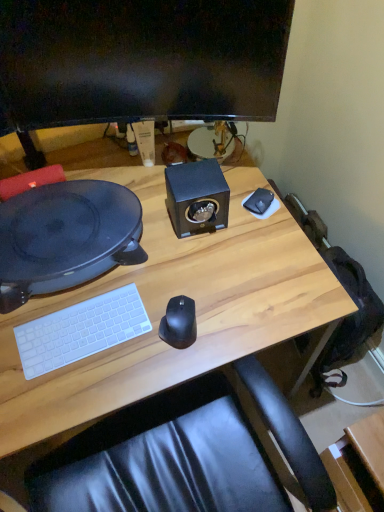
Question: Considering the relative positions of black plastic record player at left and white matte mousepad at upper right in the image provided, is black plastic record player at left to the left of white matte mousepad at upper right from the viewer's perspective?

Choices:
 (A) no
 (B) yes

Answer: (B)

Question: Would you say white matte mousepad at upper right is part of black plastic record player at left's contents?

Choices:
 (A) no
 (B) yes

Answer: (A)

Question: Is black plastic record player at left thinner than white matte mousepad at upper right?

Choices:
 (A) yes
 (B) no

Answer: (B)

Question: Does black plastic record player at left turn towards white matte mousepad at upper right?

Choices:
 (A) no
 (B) yes

Answer: (A)

Question: From a real-world perspective, is black plastic record player at left physically below white matte mousepad at upper right?

Choices:
 (A) no
 (B) yes

Answer: (A)

Question: Is black matte mouse at center wider or thinner than black matte speaker at center?

Choices:
 (A) wide
 (B) thin

Answer: (B)

Question: From a real-world perspective, relative to black matte speaker at center, is black matte mouse at center vertically above or below?

Choices:
 (A) above
 (B) below

Answer: (B)

Question: Visually, is black matte mouse at center positioned to the left or to the right of black matte speaker at center?

Choices:
 (A) right
 (B) left

Answer: (B)

Question: Is black matte mouse at center inside or outside of black matte speaker at center?

Choices:
 (A) outside
 (B) inside

Answer: (A)

Question: From a real-world perspective, is black plastic record player at left positioned above or below black matte speaker at center?

Choices:
 (A) above
 (B) below

Answer: (B)

Question: Is point (26, 248) positioned closer to the camera than point (221, 203)?

Choices:
 (A) closer
 (B) farther

Answer: (A)

Question: In terms of size, does black plastic record player at left appear bigger or smaller than black matte speaker at center?

Choices:
 (A) big
 (B) small

Answer: (A)

Question: In terms of width, does black plastic record player at left look wider or thinner when compared to black matte speaker at center?

Choices:
 (A) wide
 (B) thin

Answer: (A)

Question: From the image's perspective, is black matte mouse at center located above or below white matte mousepad at upper right?

Choices:
 (A) below
 (B) above

Answer: (A)

Question: From a real-world perspective, is black matte mouse at center positioned above or below white matte mousepad at upper right?

Choices:
 (A) above
 (B) below

Answer: (A)